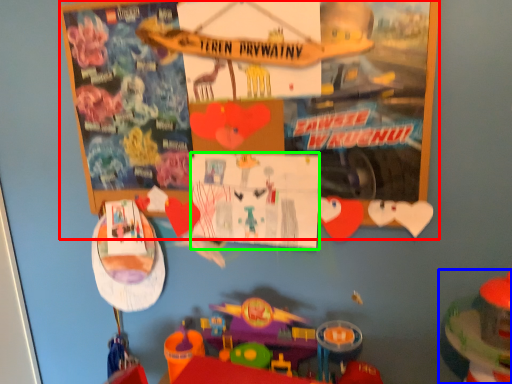
Question: Which is nearer to the bulletin board (highlighted by a red box)? toy (highlighted by a blue box) or poster page (highlighted by a green box).

Choices:
 (A) toy
 (B) poster page

Answer: (B)